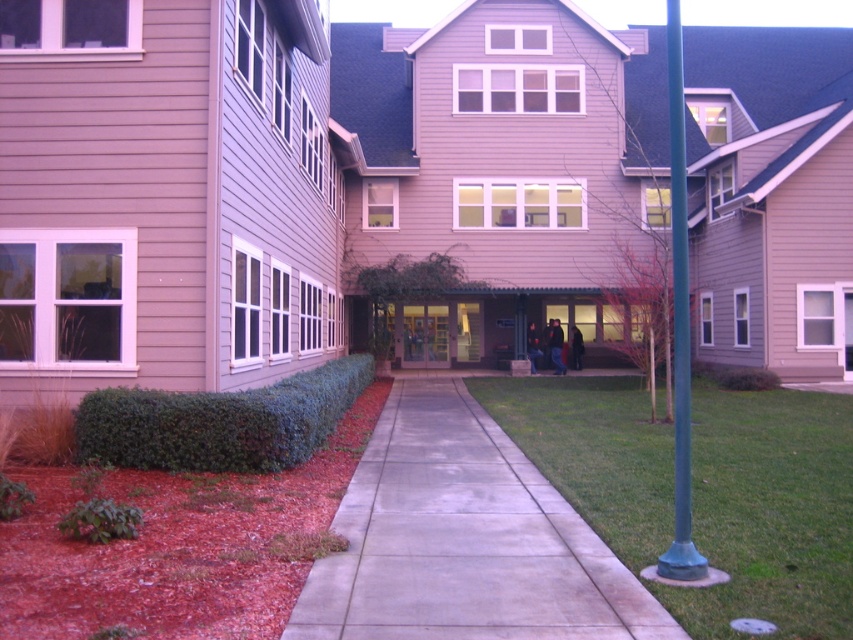
Looking at this image, you are a gardener planning to mow the green grass at center and trim the green metallic pole at right. Which area requires more time to maintain based on their size?

The green metallic pole at right requires more time to maintain because it occupies more space than the green grass at center.

You are a delivery person approaching the entrance of the building. You need to place a package on the green grass at center and the green metallic pole at right. Which object should you place the package on first as you walk towards the entrance?

You should place the package on the green grass at center first because it is closer to the viewer than the green metallic pole at right, so you reach it sooner while approaching the entrance.

You are a gardener standing on the walkway in front of the building. You need to water the green grass at center and the green metallic pole at right. Which of these two objects is closer to the ground?

→ The green grass at center is closer to the ground since it is located below the green metallic pole at right.